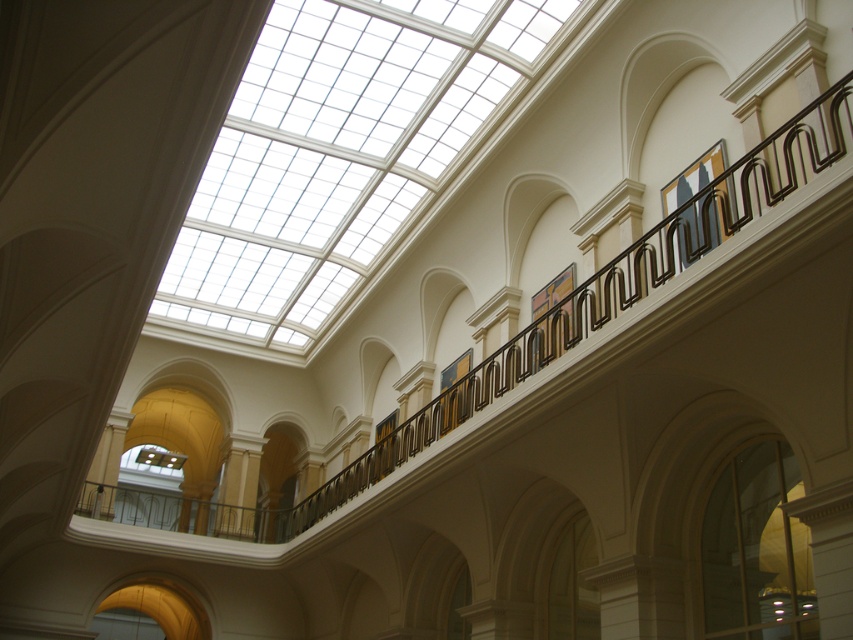
Question: Where is transparent glass window at lower right located in relation to matte black painting at upper right in the image?

Choices:
 (A) below
 (B) above

Answer: (A)

Question: Which object is the closest to the transparent glass skylight at upper center?

Choices:
 (A) matte black painting at upper right
 (B) transparent glass window at lower right

Answer: (A)

Question: Is transparent glass skylight at upper center thinner than transparent glass window at lower right?

Choices:
 (A) yes
 (B) no

Answer: (B)

Question: Among these points, which one is farthest from the camera?

Choices:
 (A) (776, 560)
 (B) (239, 278)
 (C) (692, 216)

Answer: (B)

Question: Can you confirm if transparent glass skylight at upper center is thinner than matte black painting at upper right?

Choices:
 (A) yes
 (B) no

Answer: (B)

Question: Which is farther from the transparent glass skylight at upper center?

Choices:
 (A) transparent glass window at lower right
 (B) matte black painting at upper right

Answer: (A)